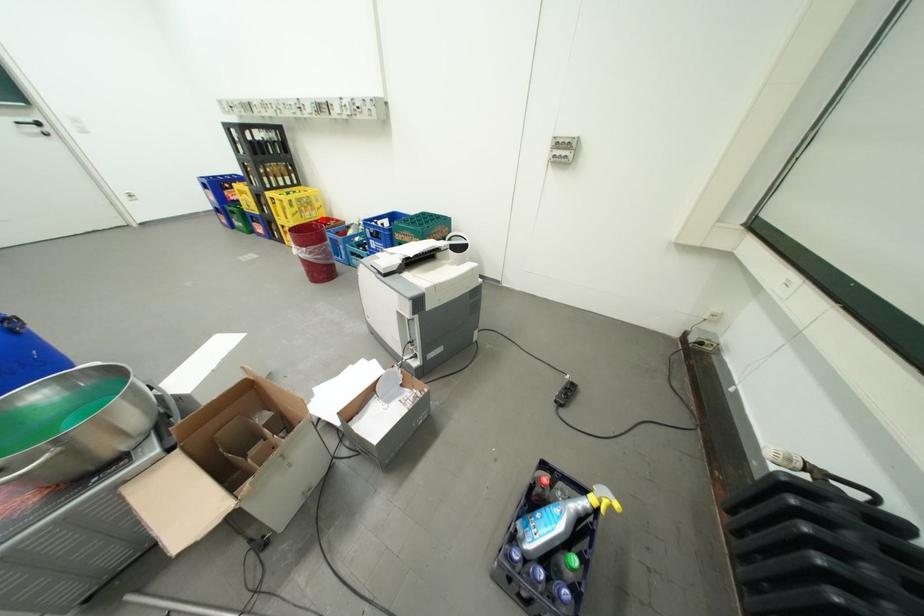
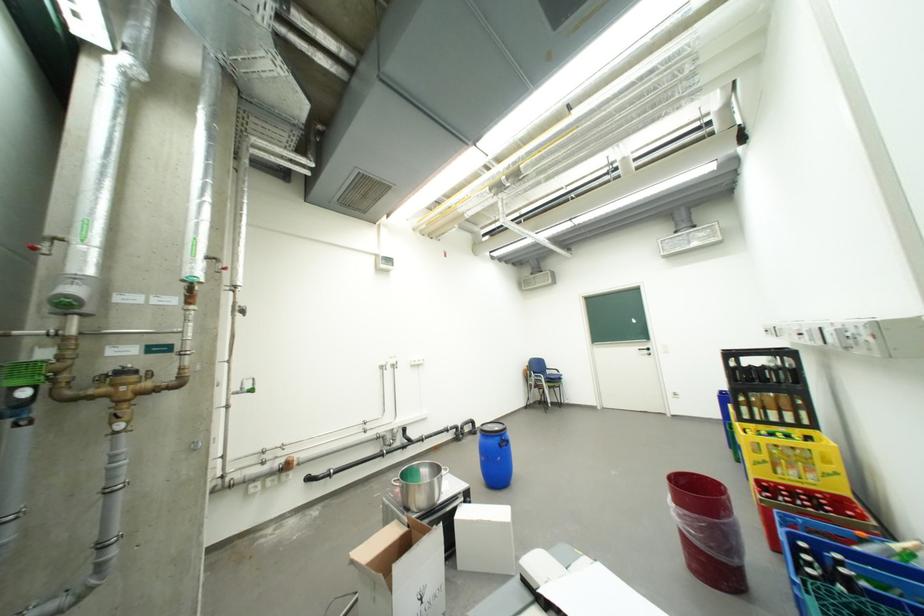
Where in the second image is the point corresponding to the highlighted location from the first image?

(810, 484)